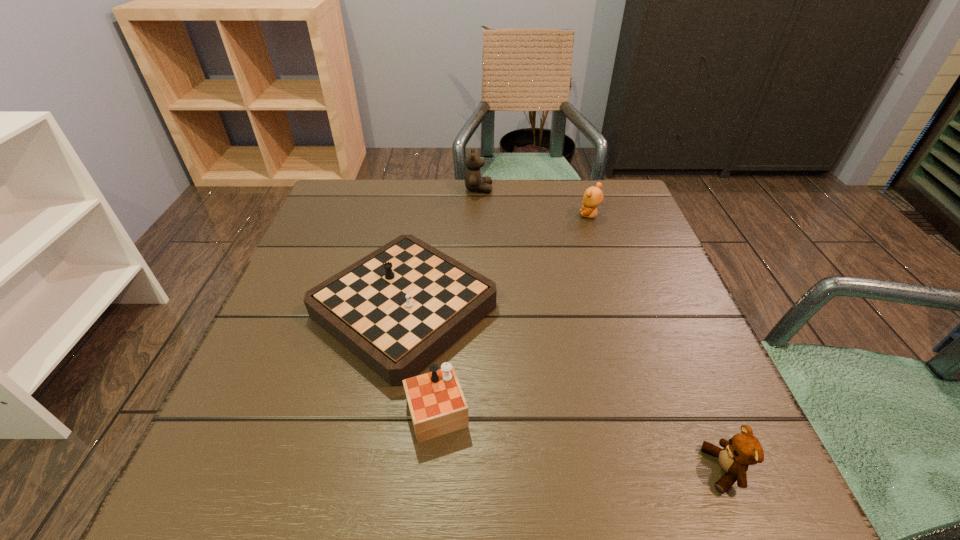
This screenshot has width=960, height=540. In order to click on free space between the rightmost object and the second teddy bear from left to right in this screenshot , I will do `click(657, 342)`.

This screenshot has height=540, width=960. Find the location of `vacant space in between the nearest teddy bear and the tallest object`. vacant space in between the nearest teddy bear and the tallest object is located at coordinates (601, 329).

Locate an element on the screen. Image resolution: width=960 pixels, height=540 pixels. vacant space that's between the chessboard and the second nearest teddy bear is located at coordinates (495, 271).

This screenshot has width=960, height=540. I want to click on free space between the second object from right to left and the leftmost teddy bear, so pyautogui.click(x=534, y=202).

Image resolution: width=960 pixels, height=540 pixels. Identify the location of vacant area that lies between the farthest teddy bear and the third object from left to right. (534, 202).

The width and height of the screenshot is (960, 540). What are the coordinates of `object that ranks as the second closest to the farthest teddy bear` in the screenshot? It's located at (397, 309).

Image resolution: width=960 pixels, height=540 pixels. What are the coordinates of `object that is the second nearest to the second teddy bear from right to left` in the screenshot? It's located at (397, 309).

Identify which teddy bear is the closest to the third nearest object. Please provide its 2D coordinates. Your answer should be formatted as a tuple, i.e. [(x, y)], where the tuple contains the x and y coordinates of a point satisfying the conditions above.

[(474, 181)]

At what (x,y) coordinates should I click in order to perform the action: click on the closest teddy bear to the third nearest object. Please return your answer as a coordinate pair (x, y). This screenshot has width=960, height=540. Looking at the image, I should click on (474, 181).